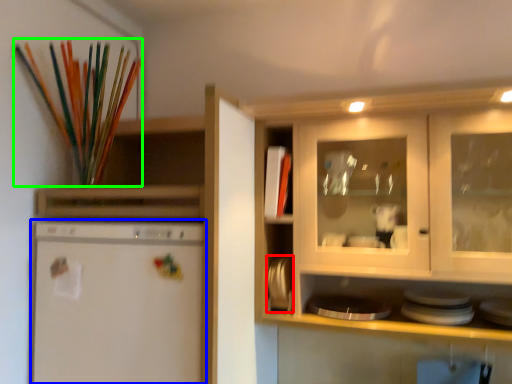
Question: Estimate the real-world distances between objects in this image. Which object is farther from appliance (highlighted by a red box), home appliance (highlighted by a blue box) or paint brush (highlighted by a green box)?

Choices:
 (A) home appliance
 (B) paint brush

Answer: (B)